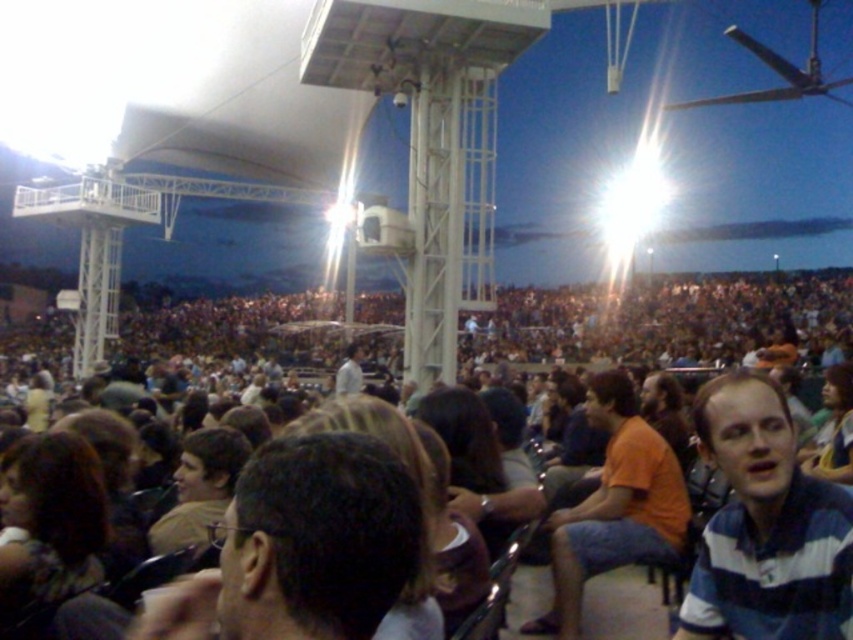
In the scene shown: Does dark brown hair at center have a greater height compared to light brown hair at center?

Indeed, dark brown hair at center has a greater height compared to light brown hair at center.

Which is behind, point (309, 612) or point (190, 461)?

The point (190, 461) is more distant.

Where is `dark brown hair at center`? dark brown hair at center is located at coordinates (303, 547).

Can you confirm if striped cotton shirt at lower right is positioned below dark brown hair at lower left?

Correct, striped cotton shirt at lower right is located below dark brown hair at lower left.

Who is higher up, striped cotton shirt at lower right or dark brown hair at lower left?

dark brown hair at lower left is higher up.

The height and width of the screenshot is (640, 853). I want to click on striped cotton shirt at lower right, so click(764, 525).

The image size is (853, 640). What are the coordinates of `striped cotton shirt at lower right` in the screenshot? It's located at (764, 525).

From the picture: Between dark brown hair at lower left and light brown hair at center, which one appears on the left side from the viewer's perspective?

dark brown hair at lower left is more to the left.

Can you confirm if dark brown hair at lower left is positioned below light brown hair at center?

No.

Between point (27, 600) and point (230, 429), which one is positioned behind?

Positioned behind is point (230, 429).

Where is `dark brown hair at lower left`? The width and height of the screenshot is (853, 640). dark brown hair at lower left is located at coordinates (49, 524).